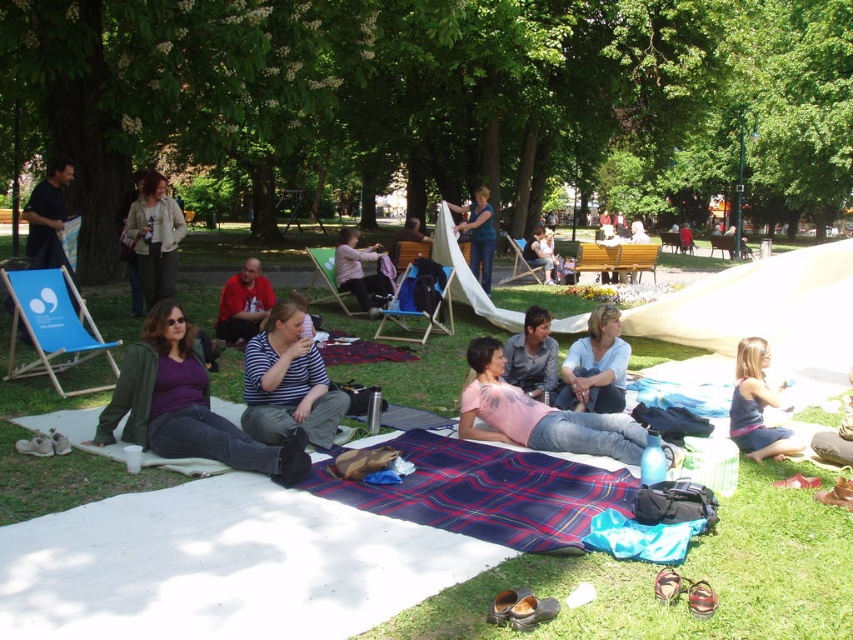
You are at the park and see a person wearing a matte purple shirt at center. There is a point marked at coordinates (x=184, y=404). Where exactly is this point located?

The point at (x=184, y=404) is located on the matte purple shirt at center.

You are at a park and see both the green grass at center and the plaid fabric blanket at center. Which object is positioned to the left?

The green grass at center is to the left of the plaid fabric blanket at center.

You are a guest at the park picnic and want to sit on the plaid fabric blanket at center. Where should you place your picnic basket so it stays on the green grass at center?

Place the picnic basket on the green grass at center, which is located below the plaid fabric blanket at center, so it stays there.